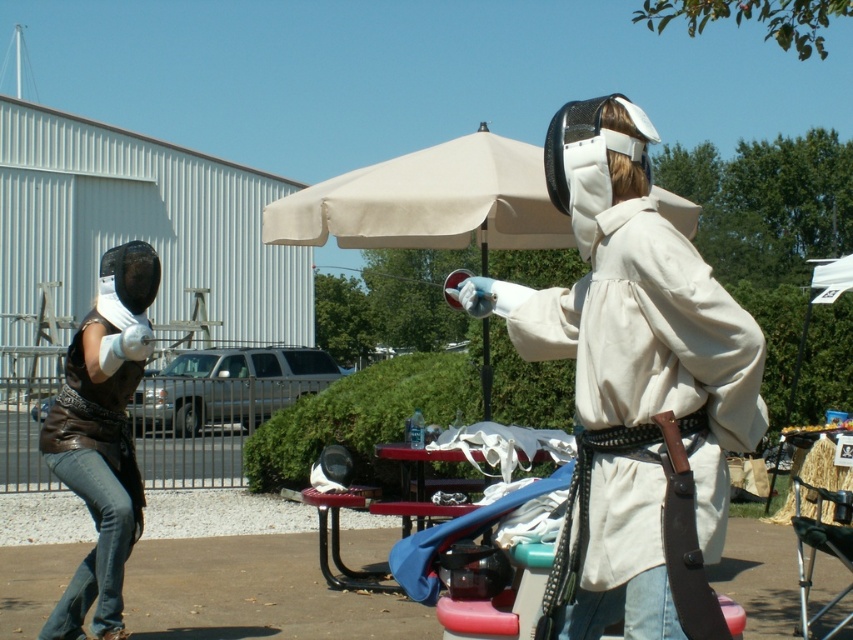
You are a photographer standing at the edge of the fencing practice area. You want to take a photo of the beige fabric umbrella at center without including any of the fencers. Given that the umbrella is 21.51 feet away from you, can you step back further to ensure the fencers are out of frame?

The beige fabric umbrella at center is 21.51 feet away from the viewer. If you step back further, the distance to the umbrella increases, which might make it smaller in the frame but could also potentially exclude the fencers if they are closer to your original position. However, without knowing the exact positions and distances of the fencers relative to both you and the umbrella, it is uncertain whether stepping back will successfully exclude them from the photo.